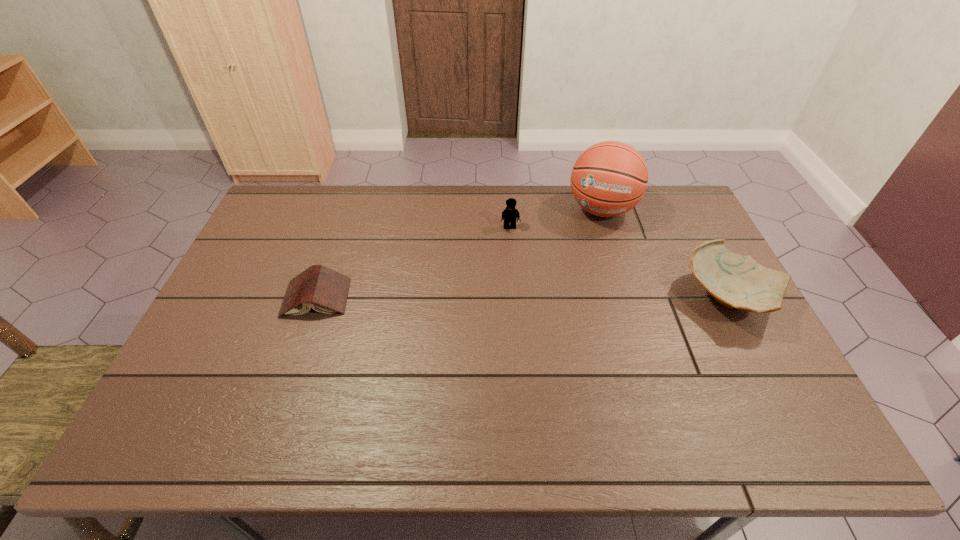
Locate an element on the screen. The image size is (960, 540). vacant spot on the desktop that is between the leftmost object and the pottery and is positioned on the front-facing side of the Lego is located at coordinates (517, 297).

Locate an element on the screen. Image resolution: width=960 pixels, height=540 pixels. free space on the desktop that is between the book and the pottery and is positioned on the logo side of the basketball is located at coordinates (575, 297).